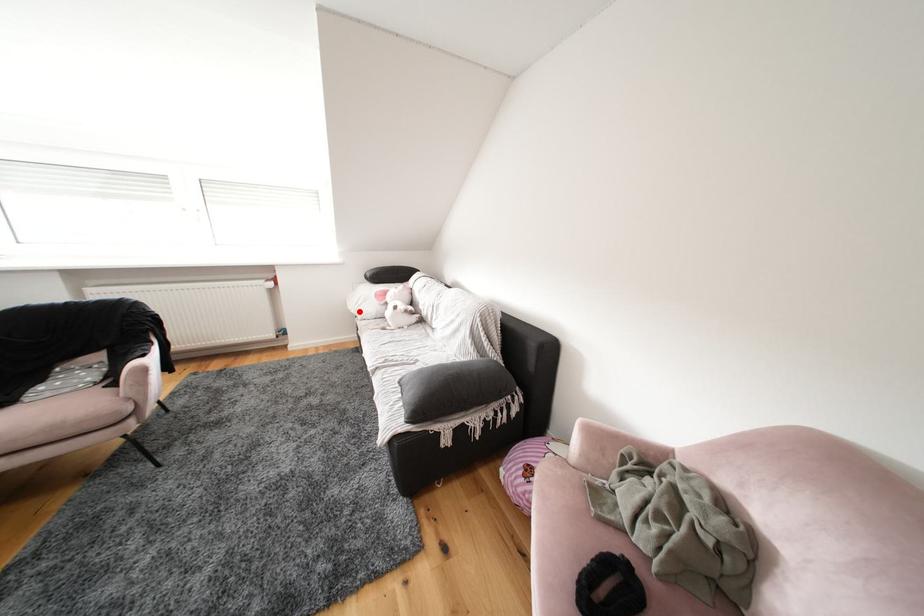
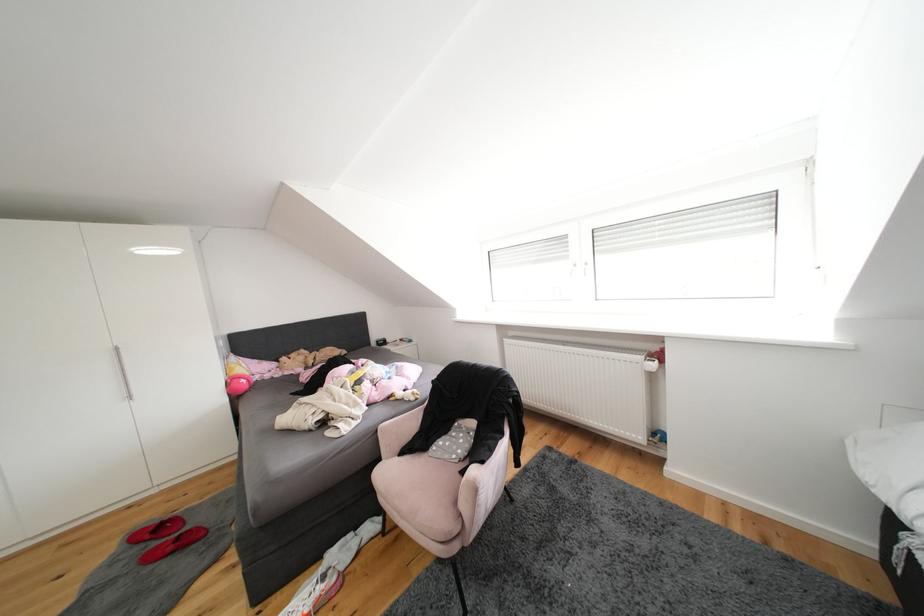
Locate, in the second image, the point that corresponds to the highlighted location in the first image.

(874, 479)